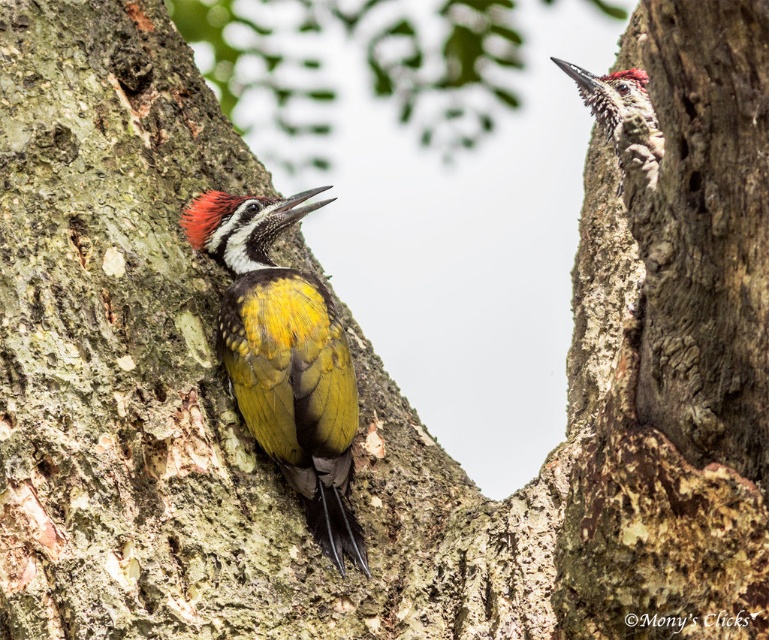
Based on the photo, is yellow-green woodpecker at center bigger than yellow-green woodpecker at upper right?

Indeed, yellow-green woodpecker at center has a larger size compared to yellow-green woodpecker at upper right.

The height and width of the screenshot is (640, 769). In order to click on yellow-green woodpecker at center in this screenshot , I will do `click(285, 356)`.